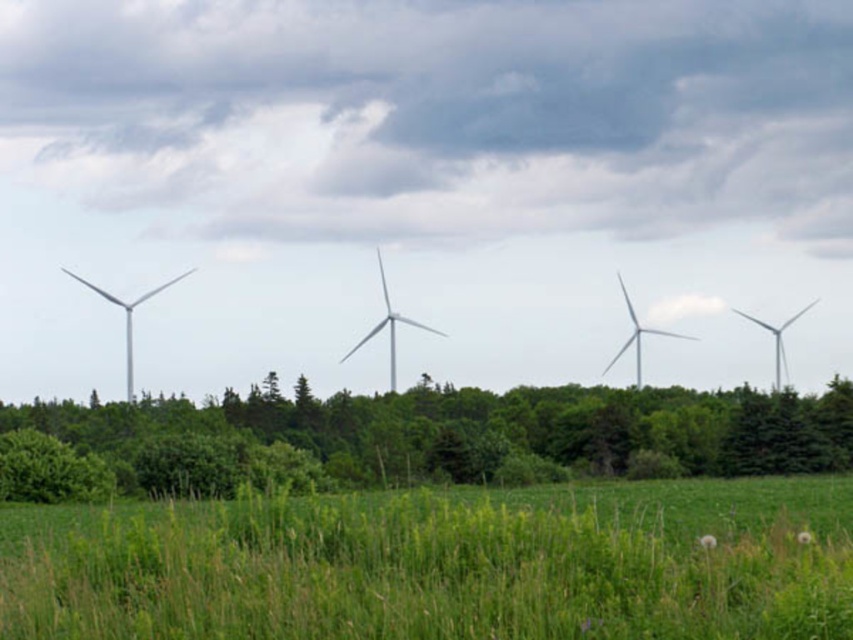
Question: Is white metallic wind turbine at center positioned in front of white metallic wind turbine at left?

Choices:
 (A) no
 (B) yes

Answer: (A)

Question: Which object is farther from the camera taking this photo?

Choices:
 (A) white metallic wind turbine at right
 (B) white matte wind turbine at center

Answer: (A)

Question: In this image, where is white metallic wind turbine at center located relative to white matte wind turbine at center?

Choices:
 (A) below
 (B) above

Answer: (A)

Question: Estimate the real-world distances between objects in this image. Which object is closer to the white metallic wind turbine at center?

Choices:
 (A) white matte wind turbine at center
 (B) white metallic wind turbine at right
 (C) white metallic wind turbine at left

Answer: (C)

Question: Observing the image, what is the correct spatial positioning of green leafy tree at lower center in reference to white metallic wind turbine at center?

Choices:
 (A) below
 (B) above

Answer: (A)

Question: Which point is closer to the camera?

Choices:
 (A) white metallic wind turbine at right
 (B) green leafy tree at lower center

Answer: (B)